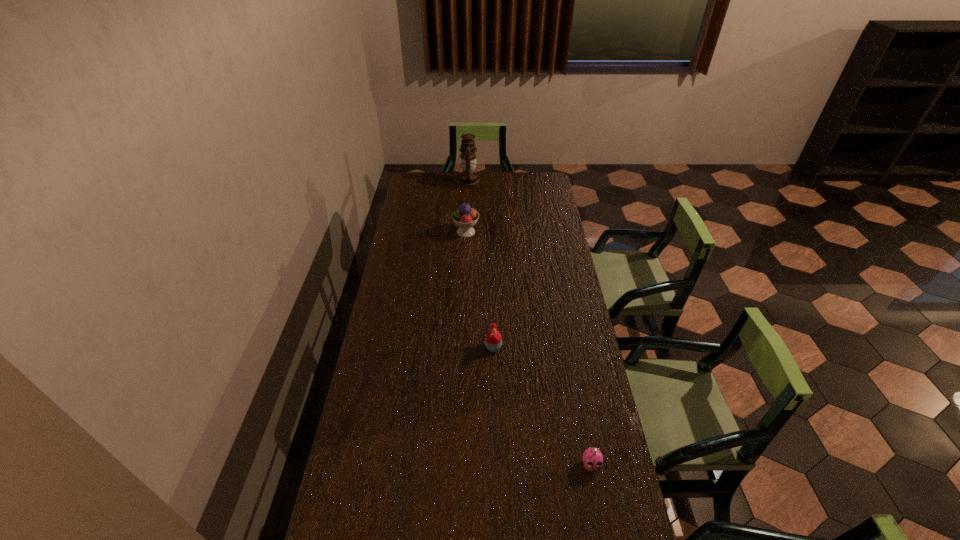
Where is `object that stands as the third closest to the farthest object`? This screenshot has width=960, height=540. object that stands as the third closest to the farthest object is located at coordinates (592, 458).

I want to click on free space that satisfies the following two spatial constraints: 1. on the front side of the second farthest object; 2. on the right side of the lantern, so click(466, 232).